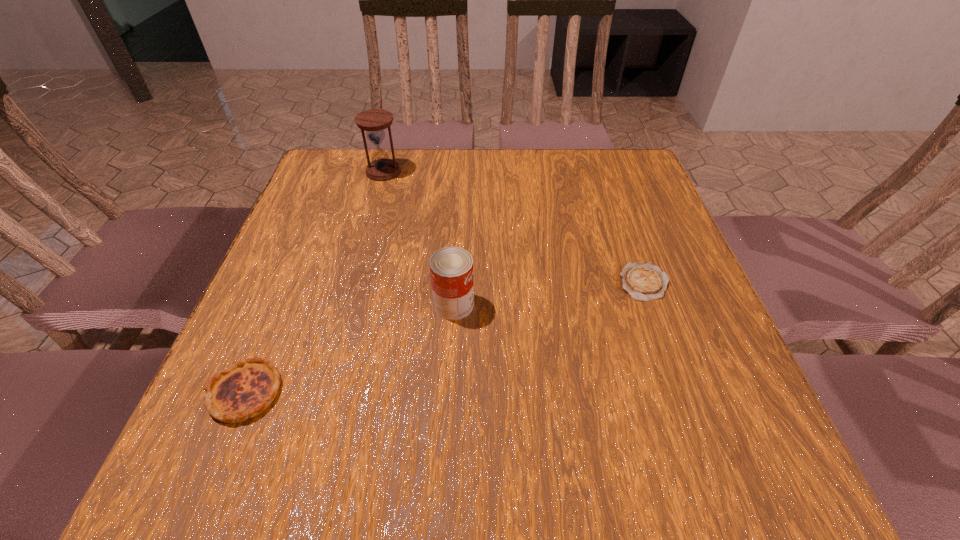
Locate an element on the screen. Image resolution: width=960 pixels, height=540 pixels. free spot located on the back of the nearest object is located at coordinates (311, 232).

Where is `free space located 0.280m on the back of the rightmost object`? The height and width of the screenshot is (540, 960). free space located 0.280m on the back of the rightmost object is located at coordinates [x=612, y=190].

Image resolution: width=960 pixels, height=540 pixels. I want to click on object present at the far edge, so click(374, 121).

Where is `hourglass that is positioned at the left edge`? This screenshot has height=540, width=960. hourglass that is positioned at the left edge is located at coordinates (374, 121).

Where is `quiche that is at the left edge`? This screenshot has height=540, width=960. quiche that is at the left edge is located at coordinates (245, 389).

The width and height of the screenshot is (960, 540). I want to click on object that is at the right edge, so (644, 281).

Identify the location of object at the far left corner. Image resolution: width=960 pixels, height=540 pixels. (374, 121).

The height and width of the screenshot is (540, 960). Identify the location of free space at the far edge. (541, 179).

What are the coordinates of `free space at the near edge of the desktop` in the screenshot? It's located at (516, 443).

This screenshot has width=960, height=540. Find the location of `free space at the left edge of the desktop`. free space at the left edge of the desktop is located at coordinates (295, 232).